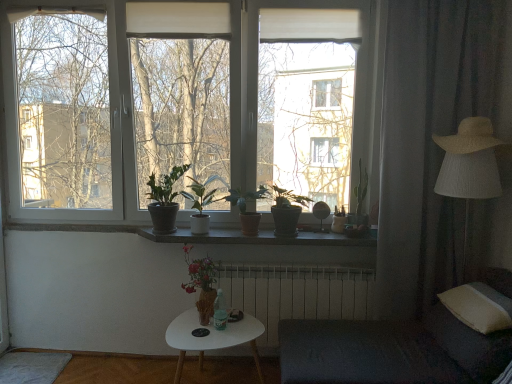
Question: Is strawmaterial/texturehat at right looking in the opposite direction of white metallic radiator at center?

Choices:
 (A) yes
 (B) no

Answer: (B)

Question: Is strawmaterial/texturehat at right facing towards white metallic radiator at center?

Choices:
 (A) yes
 (B) no

Answer: (B)

Question: Is strawmaterial/texturehat at right beside white metallic radiator at center?

Choices:
 (A) no
 (B) yes

Answer: (A)

Question: Considering the relative positions of strawmaterial/texturehat at right and white metallic radiator at center in the image provided, is strawmaterial/texturehat at right to the left of white metallic radiator at center from the viewer's perspective?

Choices:
 (A) yes
 (B) no

Answer: (B)

Question: From a real-world perspective, does strawmaterial/texturehat at right sit lower than white metallic radiator at center?

Choices:
 (A) no
 (B) yes

Answer: (A)

Question: Considering the positions of green matte plant at center, the fifth houseplant in the left-to-right sequence, and dark gray fabric armchair at lower right in the image, is green matte plant at center, the fifth houseplant in the left-to-right sequence, taller or shorter than dark gray fabric armchair at lower right?

Choices:
 (A) short
 (B) tall

Answer: (A)

Question: Would you say green matte plant at center, the fifth houseplant in the left-to-right sequence, is inside or outside dark gray fabric armchair at lower right?

Choices:
 (A) inside
 (B) outside

Answer: (B)

Question: From a real-world perspective, is green matte plant at center, the fifth houseplant in the left-to-right sequence, physically located above or below dark gray fabric armchair at lower right?

Choices:
 (A) below
 (B) above

Answer: (B)

Question: Relative to dark gray fabric armchair at lower right, is green matte plant at center, marked as the 1th houseplant in a right-to-left arrangement, in front or behind?

Choices:
 (A) behind
 (B) front

Answer: (A)

Question: Choose the correct answer: Is green matte plant at center, which ranks as the fifth houseplant in right-to-left order, inside brown matte window sill at center or outside it?

Choices:
 (A) outside
 (B) inside

Answer: (A)

Question: Is green matte plant at center, acting as the 1th houseplant starting from the left, wider or thinner than brown matte window sill at center?

Choices:
 (A) wide
 (B) thin

Answer: (B)

Question: Looking at the image, does green matte plant at center, which ranks as the fifth houseplant in right-to-left order, seem bigger or smaller compared to brown matte window sill at center?

Choices:
 (A) big
 (B) small

Answer: (A)

Question: From their relative heights in the image, would you say green matte plant at center, which ranks as the fifth houseplant in right-to-left order, is taller or shorter than brown matte window sill at center?

Choices:
 (A) tall
 (B) short

Answer: (A)

Question: Based on their positions, is green matte plant at center, marked as the 4th houseplant in a right-to-left arrangement, located to the left or right of green matte plant at center, acting as the 1th houseplant starting from the left?

Choices:
 (A) right
 (B) left

Answer: (A)

Question: From the image's perspective, relative to green matte plant at center, acting as the 1th houseplant starting from the left, is green matte plant at center, marked as the 4th houseplant in a right-to-left arrangement, above or below?

Choices:
 (A) below
 (B) above

Answer: (A)